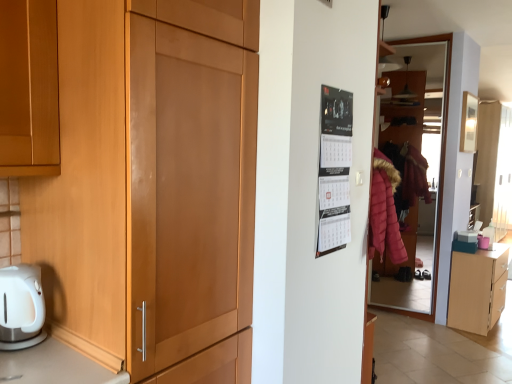
Question: From a real-world perspective, does light wood cabinet at lower right stand above black paper calendar at upper right?

Choices:
 (A) no
 (B) yes

Answer: (A)

Question: Could you tell me if light wood cabinet at lower right is facing black paper calendar at upper right?

Choices:
 (A) no
 (B) yes

Answer: (A)

Question: Is light wood cabinet at lower right behind black paper calendar at upper right?

Choices:
 (A) no
 (B) yes

Answer: (B)

Question: Is light wood cabinet at lower right to the right of black paper calendar at upper right from the viewer's perspective?

Choices:
 (A) no
 (B) yes

Answer: (B)

Question: Can you confirm if light wood cabinet at lower right is taller than black paper calendar at upper right?

Choices:
 (A) yes
 (B) no

Answer: (B)

Question: Is light wood cabinet at lower right positioned with its back to black paper calendar at upper right?

Choices:
 (A) yes
 (B) no

Answer: (B)

Question: Is matte glass door at right further to the viewer compared to light wood cabinet at lower right?

Choices:
 (A) yes
 (B) no

Answer: (A)

Question: Is matte glass door at right oriented away from light wood cabinet at lower right?

Choices:
 (A) no
 (B) yes

Answer: (A)

Question: Are matte glass door at right and light wood cabinet at lower right making contact?

Choices:
 (A) yes
 (B) no

Answer: (B)

Question: Considering the relative positions of matte glass door at right and light wood cabinet at lower right in the image provided, is matte glass door at right to the left of light wood cabinet at lower right from the viewer's perspective?

Choices:
 (A) yes
 (B) no

Answer: (A)

Question: From a real-world perspective, is matte glass door at right below light wood cabinet at lower right?

Choices:
 (A) yes
 (B) no

Answer: (B)

Question: Does matte glass door at right come in front of light wood cabinet at lower right?

Choices:
 (A) no
 (B) yes

Answer: (A)

Question: From a real-world perspective, is black paper calendar at upper right over matte glass door at right?

Choices:
 (A) yes
 (B) no

Answer: (A)